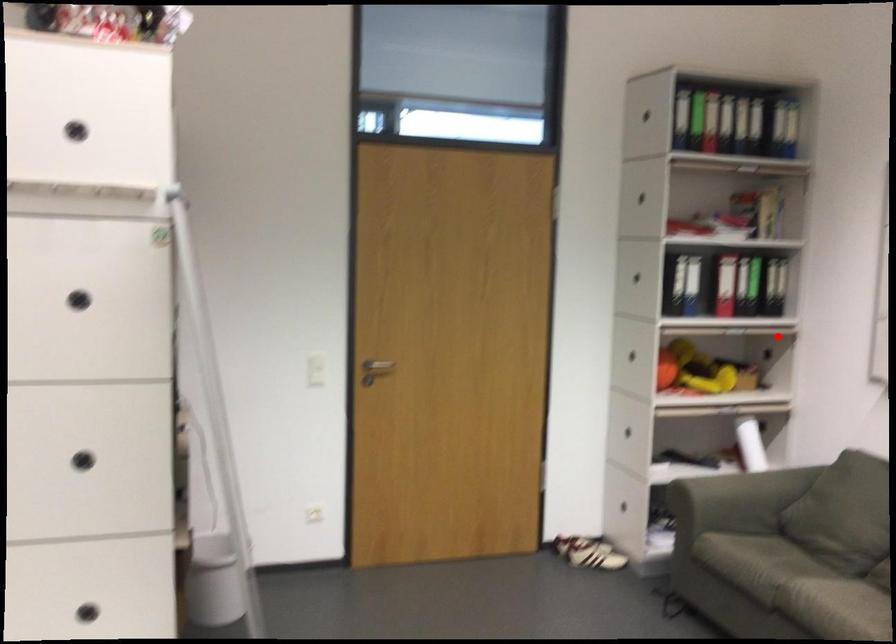
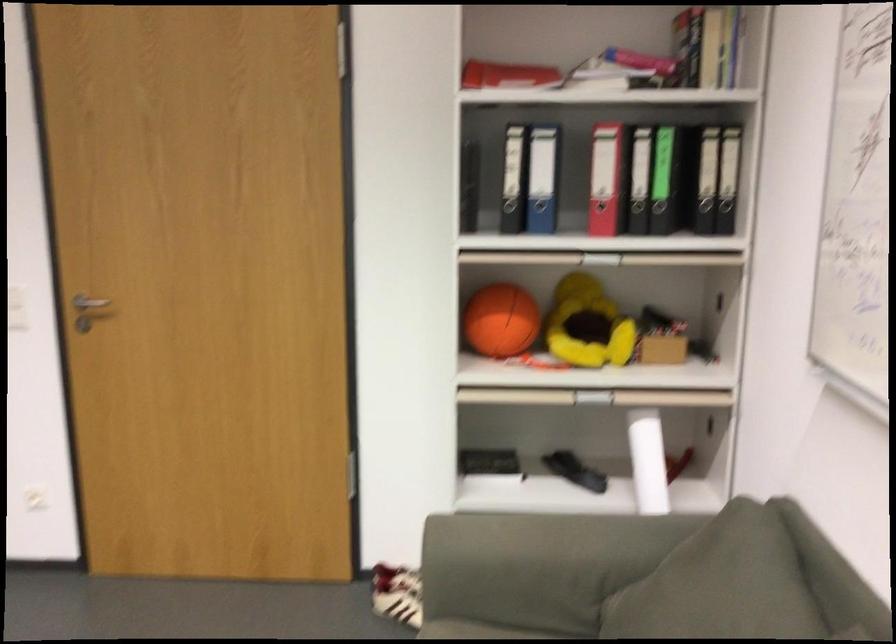
Find the pixel in the second image that matches the highlighted location in the first image.

(725, 283)